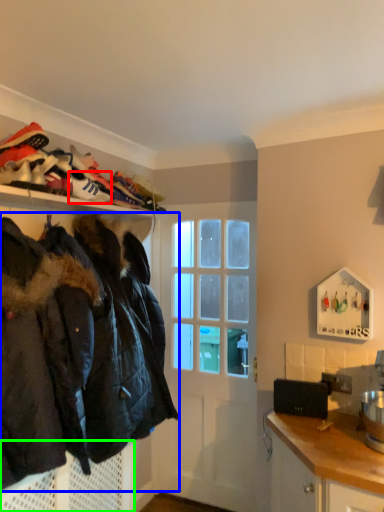
Question: Estimate the real-world distances between objects in this image. Which object is closer to shoe (highlighted by a red box), jacket (highlighted by a blue box) or cabinetry (highlighted by a green box)?

Choices:
 (A) jacket
 (B) cabinetry

Answer: (A)